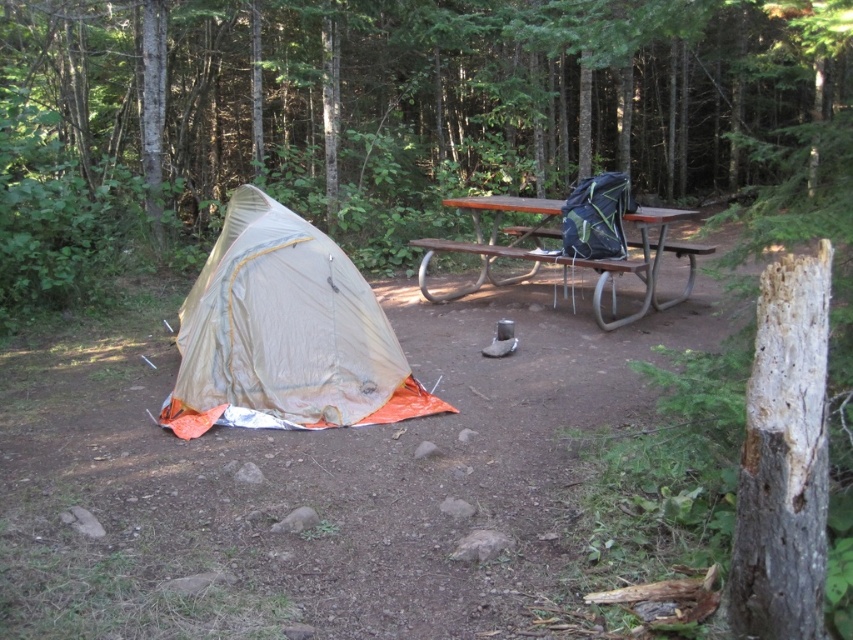
Question: Where is smooth bark tree at center located in relation to brown wooden picnic table at center in the image?

Choices:
 (A) below
 (B) above

Answer: (B)

Question: Among these objects, which one is nearest to the camera?

Choices:
 (A) beige/orange fabric tent at left
 (B) smooth bark tree at center

Answer: (B)

Question: Which of the following is the farthest from the observer?

Choices:
 (A) (471, 284)
 (B) (471, 76)
 (C) (318, 237)

Answer: (B)

Question: Is smooth bark tree at center positioned at the back of beige/orange fabric tent at left?

Choices:
 (A) no
 (B) yes

Answer: (A)

Question: Is beige/orange fabric tent at left to the right of brown wooden picnic table at center from the viewer's perspective?

Choices:
 (A) no
 (B) yes

Answer: (A)

Question: Which object is positioned closest to the smooth bark tree at center?

Choices:
 (A) beige/orange fabric tent at left
 (B) brown wooden picnic table at center

Answer: (B)